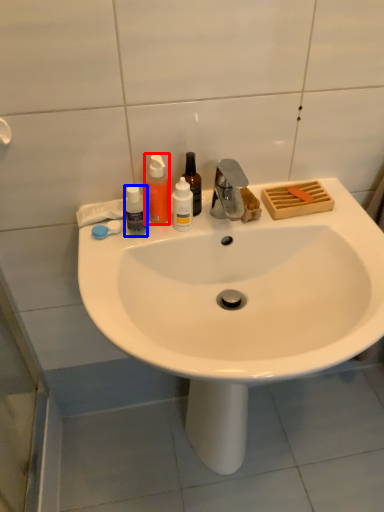
Question: Which object is closer to the camera taking this photo, bottle (highlighted by a red box) or bottle (highlighted by a blue box)?

Choices:
 (A) bottle
 (B) bottle

Answer: (B)